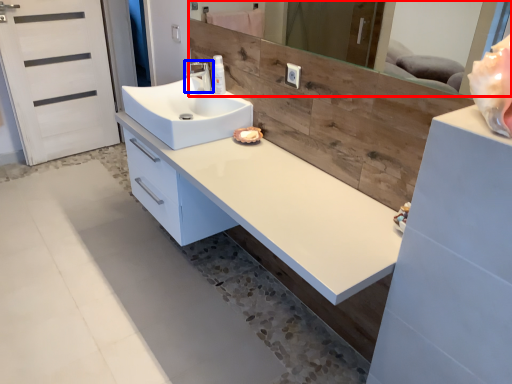
Question: Which object is closer to the camera taking this photo, mirror (highlighted by a red box) or tap (highlighted by a blue box)?

Choices:
 (A) mirror
 (B) tap

Answer: (A)